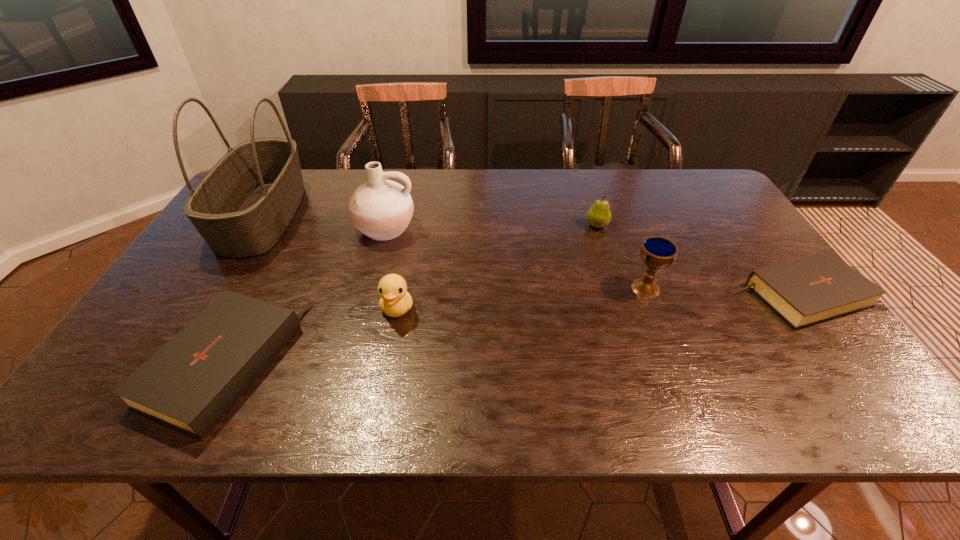
The height and width of the screenshot is (540, 960). Identify the location of object that is at the right edge. (810, 290).

At what (x,y) coordinates should I click in order to perform the action: click on object positioned at the far left corner. Please return your answer as a coordinate pair (x, y). Looking at the image, I should click on (241, 208).

Where is `object that is at the near left corner`? This screenshot has width=960, height=540. object that is at the near left corner is located at coordinates (189, 384).

You are a GUI agent. You are given a task and a screenshot of the screen. Output one action in this format:
    pyautogui.click(x=<x>, y=<y>)
    Task: Click on the vacant space at the far edge of the desktop
    This screenshot has width=960, height=540.
    Given the screenshot: What is the action you would take?
    pyautogui.click(x=328, y=176)

In order to click on vacant space at the left edge of the desktop in this screenshot , I will do `click(214, 296)`.

The height and width of the screenshot is (540, 960). Find the location of `free region at the right edge`. free region at the right edge is located at coordinates (736, 213).

Where is `vacant region at the near right corner of the desktop`? The height and width of the screenshot is (540, 960). vacant region at the near right corner of the desktop is located at coordinates (795, 351).

Where is `unoccupied area between the taller Bible and the basket`? The image size is (960, 540). unoccupied area between the taller Bible and the basket is located at coordinates (244, 290).

The width and height of the screenshot is (960, 540). Find the location of `free space between the left Bible and the basket`. free space between the left Bible and the basket is located at coordinates (244, 290).

The height and width of the screenshot is (540, 960). I want to click on free spot between the sixth shortest object and the sixth tallest object, so click(304, 296).